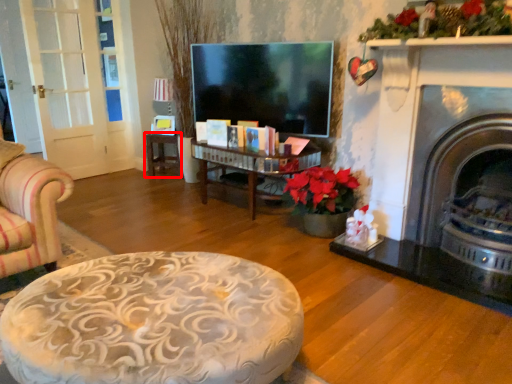
Question: From the image, what is the correct spatial relationship of table (annotated by the red box) in relation to fireplace?

Choices:
 (A) right
 (B) left

Answer: (B)